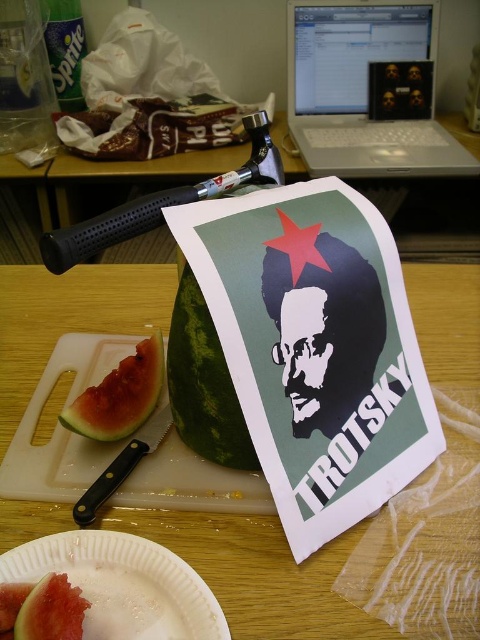
Between silver metallic laptop at upper center and white plastic plate at lower left, which one appears on the left side from the viewer's perspective?

From the viewer's perspective, white plastic plate at lower left appears more on the left side.

Which is in front, point (302, 29) or point (167, 444)?

Point (167, 444)

Between point (422, 129) and point (108, 460), which one is positioned in front?

Point (108, 460) is more forward.

Where is `silver metallic laptop at upper center`? silver metallic laptop at upper center is located at coordinates (362, 90).

Can you confirm if silver metallic laptop at upper center is positioned to the right of green textured melon at center?

Indeed, silver metallic laptop at upper center is positioned on the right side of green textured melon at center.

Does point (440, 134) come in front of point (205, 356)?

That is False.

Locate an element on the screen. Image resolution: width=480 pixels, height=640 pixels. silver metallic laptop at upper center is located at coordinates (362, 90).

Does silver metallic laptop at upper center have a smaller size compared to green matte watermelon at lower left?

No.

Is silver metallic laptop at upper center closer to camera compared to green matte watermelon at lower left?

No, silver metallic laptop at upper center is behind green matte watermelon at lower left.

Locate an element on the screen. silver metallic laptop at upper center is located at coordinates (362, 90).